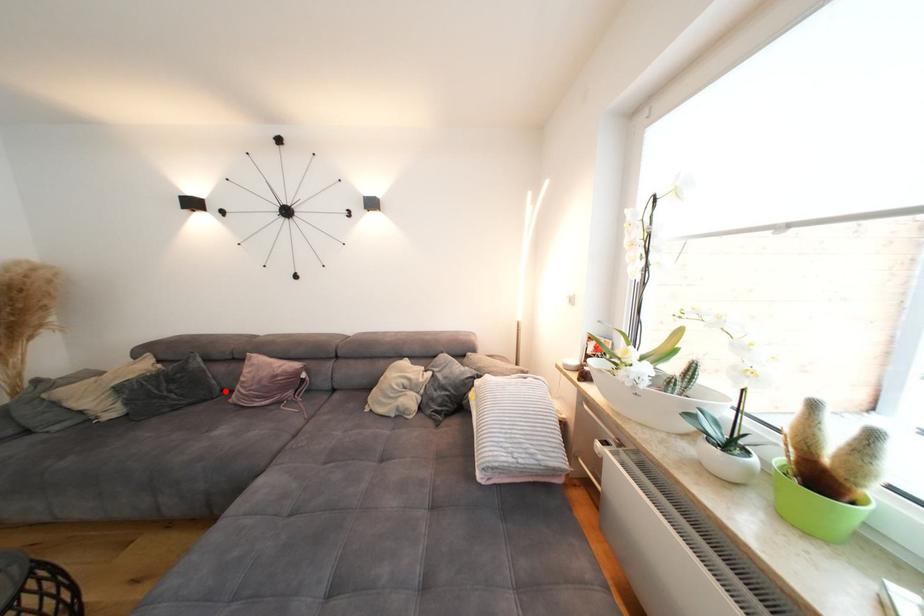
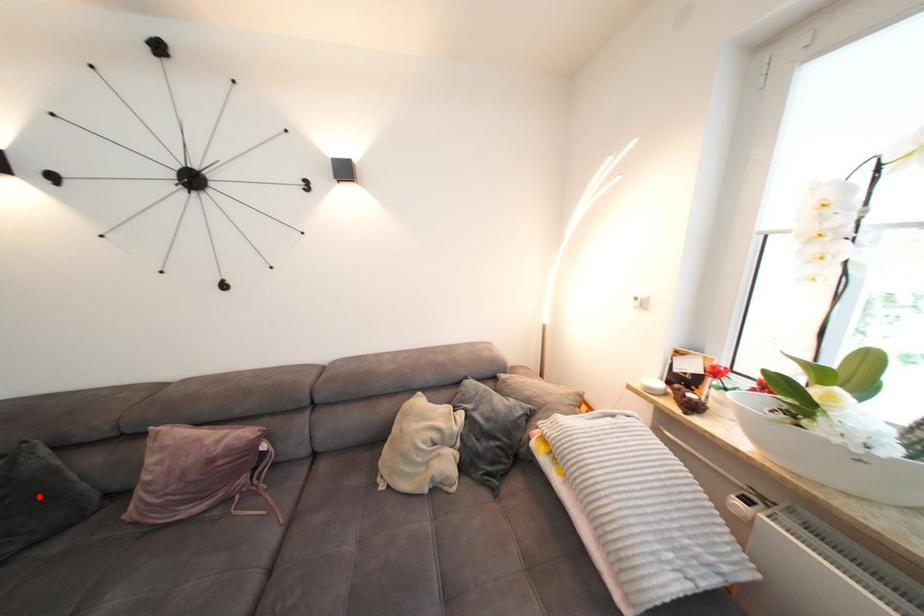
I am providing you with two images of the same scene from different viewpoints. A red point is marked on the first image and another point is marked on the second image. Do the highlighted points in image1 and image2 indicate the same real-world spot?

No